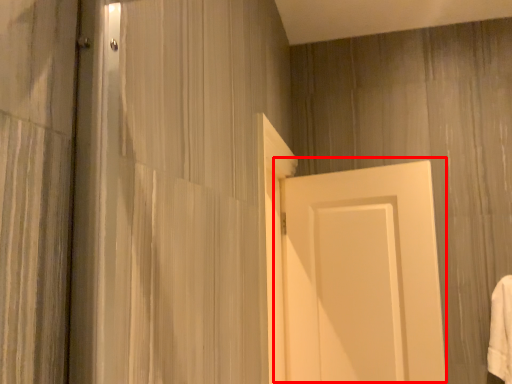
Question: From the image's perspective, what is the correct spatial relationship of door (annotated by the red box) in relation to bath towel?

Choices:
 (A) above
 (B) below

Answer: (A)